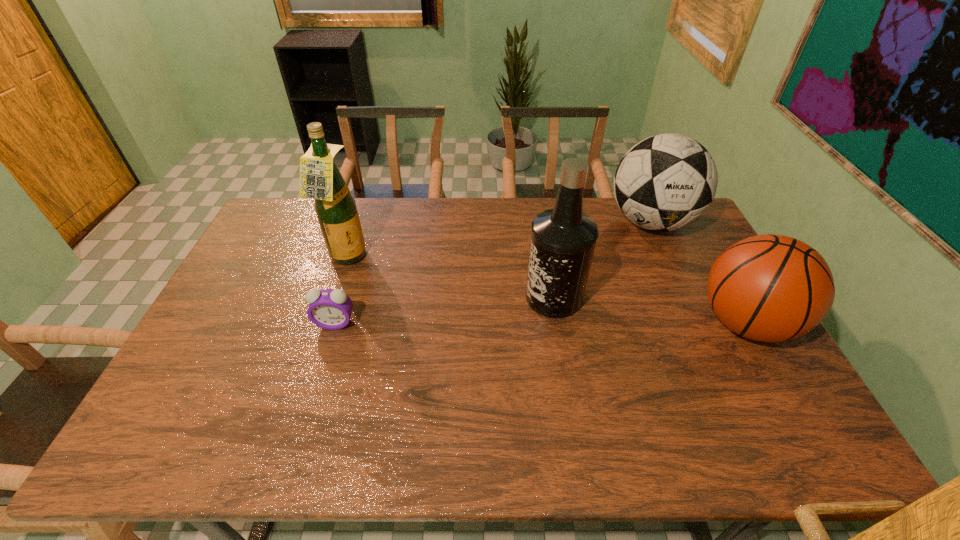
This screenshot has height=540, width=960. Find the location of `free space between the nearer liquor and the basketball`. free space between the nearer liquor and the basketball is located at coordinates (649, 310).

Locate an element on the screen. The image size is (960, 540). free space between the farther liquor and the nearer liquor is located at coordinates (450, 278).

I want to click on vacant point located between the soccer ball and the alarm clock, so click(493, 273).

Identify the location of free space between the basketball and the soccer ball. (698, 273).

The image size is (960, 540). Find the location of `object that can be found as the fourth closest to the soccer ball`. object that can be found as the fourth closest to the soccer ball is located at coordinates (330, 309).

Image resolution: width=960 pixels, height=540 pixels. I want to click on object that is the third closest to the nearer liquor, so click(330, 309).

Locate an element on the screen. The image size is (960, 540). free space that satisfies the following two spatial constraints: 1. on the back side of the right liquor; 2. on the left side of the soccer ball is located at coordinates (541, 222).

Where is `vacant point that satisfies the following two spatial constraints: 1. on the back side of the soccer ball; 2. on the right side of the left liquor`? vacant point that satisfies the following two spatial constraints: 1. on the back side of the soccer ball; 2. on the right side of the left liquor is located at coordinates (358, 222).

Where is `vacant space that satisfies the following two spatial constraints: 1. on the back side of the third object from left to right; 2. on the right side of the soccer ball`? vacant space that satisfies the following two spatial constraints: 1. on the back side of the third object from left to right; 2. on the right side of the soccer ball is located at coordinates pyautogui.click(x=541, y=222).